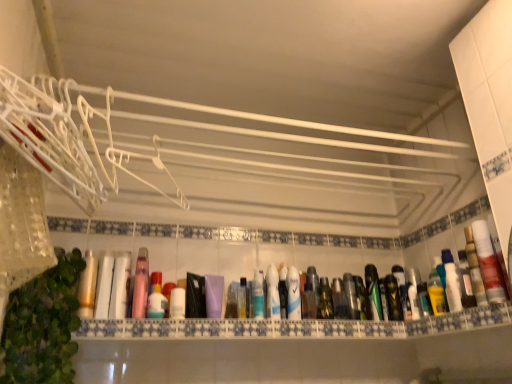
The height and width of the screenshot is (384, 512). I want to click on translucent plastic bottles at center, so click(x=295, y=326).

The height and width of the screenshot is (384, 512). What do you see at coordinates (214, 295) in the screenshot?
I see `purple matte bottle at center, the 3th mouthwash from the left` at bounding box center [214, 295].

Find the location of a particular element. white glossy mouthwash at center, positioned as the 5th mouthwash in left-to-right order is located at coordinates (293, 294).

Where is `translucent plastic bottles at center`? Image resolution: width=512 pixels, height=384 pixels. translucent plastic bottles at center is located at coordinates (295, 326).

From the image's perspective, which is above, translucent plastic bottles at center or purple matte bottle at center, the sixth mouthwash viewed from the right?

purple matte bottle at center, the sixth mouthwash viewed from the right, appears higher in the image.

Is purple matte bottle at center, the sixth mouthwash viewed from the right, inside translucent plastic bottles at center?

Definitely not — purple matte bottle at center, the sixth mouthwash viewed from the right, is not inside translucent plastic bottles at center.

Between translucent plastic bottles at center and purple matte bottle at center, the 3th mouthwash from the left, which one has more height?

With more height is purple matte bottle at center, the 3th mouthwash from the left.

Which object is more forward, white plastic bottle at right, positioned as the 8th mouthwash in left-to-right order, or blue glossy mouthwash at center, which is the fourth mouthwash from left to right?

white plastic bottle at right, positioned as the 8th mouthwash in left-to-right order, is closer to the camera.

From a real-world perspective, does white plastic bottle at right, the first mouthwash in the right-to-left sequence, sit lower than blue glossy mouthwash at center, which is counted as the fifth mouthwash, starting from the right?

Actually, white plastic bottle at right, the first mouthwash in the right-to-left sequence, is physically above blue glossy mouthwash at center, which is counted as the fifth mouthwash, starting from the right, in the real world.

Does white plastic bottle at right, positioned as the 8th mouthwash in left-to-right order, have a lesser height compared to blue glossy mouthwash at center, which is counted as the fifth mouthwash, starting from the right?

No, white plastic bottle at right, positioned as the 8th mouthwash in left-to-right order, is not shorter than blue glossy mouthwash at center, which is counted as the fifth mouthwash, starting from the right.

Does white plastic bottle at right, positioned as the 8th mouthwash in left-to-right order, appear on the right side of blue glossy mouthwash at center, which is counted as the fifth mouthwash, starting from the right?

Yes.

Is translucent plastic mouthwash at center, the 6th mouthwash when ordered from left to right, next to purple matte bottle at center, the sixth mouthwash viewed from the right?

They are not placed beside each other.

From the image's perspective, relative to purple matte bottle at center, the 3th mouthwash from the left, is translucent plastic mouthwash at center, marked as the third mouthwash in a right-to-left arrangement, above or below?

translucent plastic mouthwash at center, marked as the third mouthwash in a right-to-left arrangement, is situated lower than purple matte bottle at center, the 3th mouthwash from the left, in the image.

Is translucent plastic mouthwash at center, the 6th mouthwash when ordered from left to right, positioned with its back to purple matte bottle at center, the sixth mouthwash viewed from the right?

No, translucent plastic mouthwash at center, the 6th mouthwash when ordered from left to right, is not facing the opposite direction of purple matte bottle at center, the sixth mouthwash viewed from the right.

Can you confirm if purple matte bottle at center, the 3th mouthwash from the left, is thinner than translucent plastic bottles at center?

Yes.

From the translucent plastic bottles at center, count 3rd mouthwashs backward and point to it. Please provide its 2D coordinates.

[(214, 295)]

From a real-world perspective, is purple matte bottle at center, the 3th mouthwash from the left, physically above translucent plastic bottles at center?

Yes, from a real-world perspective, purple matte bottle at center, the 3th mouthwash from the left, is over translucent plastic bottles at center

Is the position of purple matte bottle at center, the sixth mouthwash viewed from the right, more distant than that of translucent plastic bottles at center?

That is True.

Considering the relative positions of green leafy plant at lower left and translucent plastic bottles at center in the image provided, is green leafy plant at lower left to the left of translucent plastic bottles at center from the viewer's perspective?

Correct, you'll find green leafy plant at lower left to the left of translucent plastic bottles at center.

Which of these two, green leafy plant at lower left or translucent plastic bottles at center, stands shorter?

translucent plastic bottles at center is shorter.

From the image's perspective, is green leafy plant at lower left over translucent plastic bottles at center?

Yes, from the image's perspective, green leafy plant at lower left is above translucent plastic bottles at center.

From a real-world perspective, is green leafy plant at lower left positioned above or below translucent plastic bottles at center?

From a real-world perspective, green leafy plant at lower left is physically above translucent plastic bottles at center.

Starting from the purple matte bottle at center, the sixth mouthwash viewed from the right, which mouthwash is the 2nd one behind? Please provide its 2D coordinates.

[(258, 295)]

Is purple matte bottle at center, the 3th mouthwash from the left, far away from blue glossy mouthwash at center, which is the fourth mouthwash from left to right?

purple matte bottle at center, the 3th mouthwash from the left, is actually quite close to blue glossy mouthwash at center, which is the fourth mouthwash from left to right.

Is purple matte bottle at center, the 3th mouthwash from the left, closer to camera compared to blue glossy mouthwash at center, which is the fourth mouthwash from left to right?

Yes, it is.

From the picture: Is purple matte bottle at center, the sixth mouthwash viewed from the right, positioned with its back to blue glossy mouthwash at center, which is counted as the fifth mouthwash, starting from the right?

No, blue glossy mouthwash at center, which is counted as the fifth mouthwash, starting from the right, is not at the back of purple matte bottle at center, the sixth mouthwash viewed from the right.

From the white plastic bottle at right, positioned as the 8th mouthwash in left-to-right order, count 5th mouthwashs backward and point to it. Please provide its 2D coordinates.

[(258, 295)]

Can you confirm if blue glossy mouthwash at center, which is counted as the fifth mouthwash, starting from the right, is bigger than white plastic bottle at right, positioned as the 8th mouthwash in left-to-right order?

Incorrect, blue glossy mouthwash at center, which is counted as the fifth mouthwash, starting from the right, is not larger than white plastic bottle at right, positioned as the 8th mouthwash in left-to-right order.

Does point (256, 291) lie in front of point (486, 274)?

That is False.

From the image's perspective, is blue glossy mouthwash at center, which is counted as the fifth mouthwash, starting from the right, on white plastic bottle at right, the first mouthwash in the right-to-left sequence?

Incorrect, from the image's perspective, blue glossy mouthwash at center, which is counted as the fifth mouthwash, starting from the right, is lower than white plastic bottle at right, the first mouthwash in the right-to-left sequence.

Identify the location of ledge beneath the purple matte bottle at center, the 3th mouthwash from the left (from a real-world perspective). (295, 326).

From the image's perspective, count 5th mouthwashs upward from the blue glossy mouthwash at center, which is counted as the fifth mouthwash, starting from the right, and point to it. Please provide its 2D coordinates.

[(488, 263)]

Looking at the image, which one is located further to metallic silver spray can at center, blue glossy mouthwash at center, which is the fourth mouthwash from left to right, or white plastic bottle at right, the first mouthwash in the right-to-left sequence?

white plastic bottle at right, the first mouthwash in the right-to-left sequence, is further to metallic silver spray can at center.

From the image, which object appears to be nearer to pink glossy bottle at center, which ranks as the 2th mouthwash in left-to-right order, green matte bottle at center, which appears as the 7th mouthwash when viewed from the left, or metallic silver spray can at center?

Among the two, metallic silver spray can at center is located nearer to pink glossy bottle at center, which ranks as the 2th mouthwash in left-to-right order.

Based on the photo, which object lies nearer to the anchor point green leafy plant at lower left, metallic silver spray can at center or translucent plastic mouthwash at center, the 6th mouthwash when ordered from left to right?

The object closer to green leafy plant at lower left is translucent plastic mouthwash at center, the 6th mouthwash when ordered from left to right.

Estimate the real-world distances between objects in this image. Which object is closer to blue glossy mouthwash at center, which is the fourth mouthwash from left to right, green matte bottle at center, which appears as the 7th mouthwash when viewed from the left, or green leafy plant at lower left?

The object closer to blue glossy mouthwash at center, which is the fourth mouthwash from left to right, is green matte bottle at center, which appears as the 7th mouthwash when viewed from the left.

From the image, which object appears to be nearer to pink glossy bottle at center, which ranks as the 2th mouthwash in left-to-right order, blue glossy mouthwash at center, which is counted as the fifth mouthwash, starting from the right, or white glossy mouthwash at center, positioned as the 5th mouthwash in left-to-right order?

Based on the image, blue glossy mouthwash at center, which is counted as the fifth mouthwash, starting from the right, appears to be nearer to pink glossy bottle at center, which ranks as the 2th mouthwash in left-to-right order.

Estimate the real-world distances between objects in this image. Which object is closer to white plastic bottle at right, positioned as the 8th mouthwash in left-to-right order, purple matte bottle at center, the sixth mouthwash viewed from the right, or blue glossy mouthwash at center, which is the fourth mouthwash from left to right?

Among the two, blue glossy mouthwash at center, which is the fourth mouthwash from left to right, is located nearer to white plastic bottle at right, positioned as the 8th mouthwash in left-to-right order.

Estimate the real-world distances between objects in this image. Which object is further from translucent plastic mouthwash at center, marked as the third mouthwash in a right-to-left arrangement, blue glossy mouthwash at center, which is the fourth mouthwash from left to right, or purple matte bottle at center, the 3th mouthwash from the left?

Based on the image, purple matte bottle at center, the 3th mouthwash from the left, appears to be further to translucent plastic mouthwash at center, marked as the third mouthwash in a right-to-left arrangement.

Based on their spatial positions, is pink glossy bottle at center, the 7th mouthwash when ordered from right to left, or white plastic bottle at right, positioned as the 8th mouthwash in left-to-right order, closer to green matte bottle at center, which is the second mouthwash from right to left?

Based on the image, white plastic bottle at right, positioned as the 8th mouthwash in left-to-right order, appears to be nearer to green matte bottle at center, which is the second mouthwash from right to left.

You are a GUI agent. You are given a task and a screenshot of the screen. Output one action in this format:
    pyautogui.click(x=<x>, y=<y>)
    Task: Click on the ledge between white matte tube at center, marked as the 8th mouthwash in a right-to-left arrangement, and translucent plastic mouthwash at center, marked as the third mouthwash in a right-to-left arrangement, in the horizontal direction
    
    Given the screenshot: What is the action you would take?
    pyautogui.click(x=295, y=326)

In order to click on ledge between green leafy plant at lower left and white glossy mouthwash at center, placed as the 4th mouthwash when sorted from right to left in this screenshot , I will do `click(295, 326)`.

You are a GUI agent. You are given a task and a screenshot of the screen. Output one action in this format:
    pyautogui.click(x=<x>, y=<y>)
    Task: Click on the ledge located between pink glossy bottle at center, the 7th mouthwash when ordered from right to left, and blue glossy mouthwash at center, which is the fourth mouthwash from left to right, in the left-right direction
    
    Given the screenshot: What is the action you would take?
    pyautogui.click(x=295, y=326)

Find the location of `toiletry between translucent plastic mouthwash at center, marked as the third mouthwash in a right-to-left arrangement, and green matte bottle at center, which is the second mouthwash from right to left, from left to right`. toiletry between translucent plastic mouthwash at center, marked as the third mouthwash in a right-to-left arrangement, and green matte bottle at center, which is the second mouthwash from right to left, from left to right is located at coordinates (361, 297).